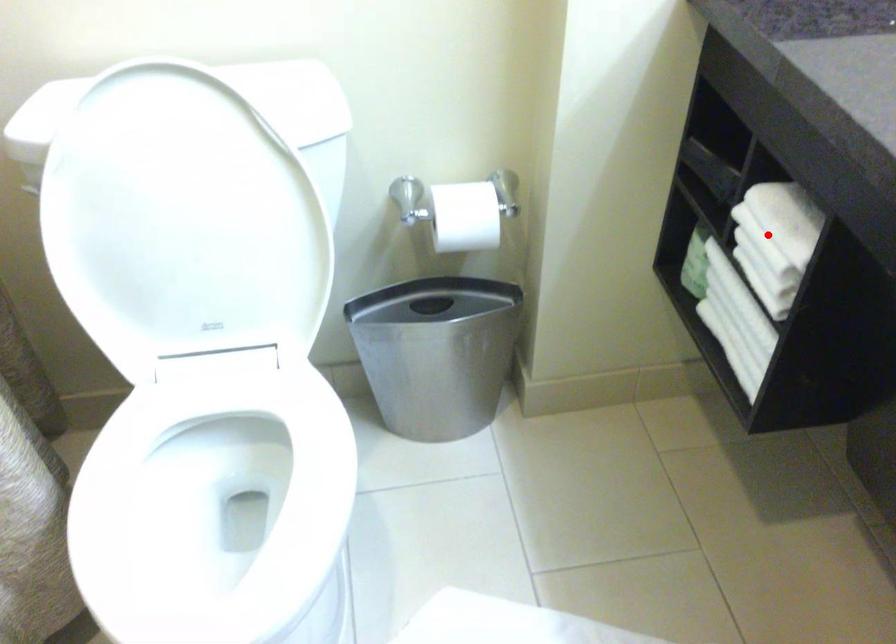
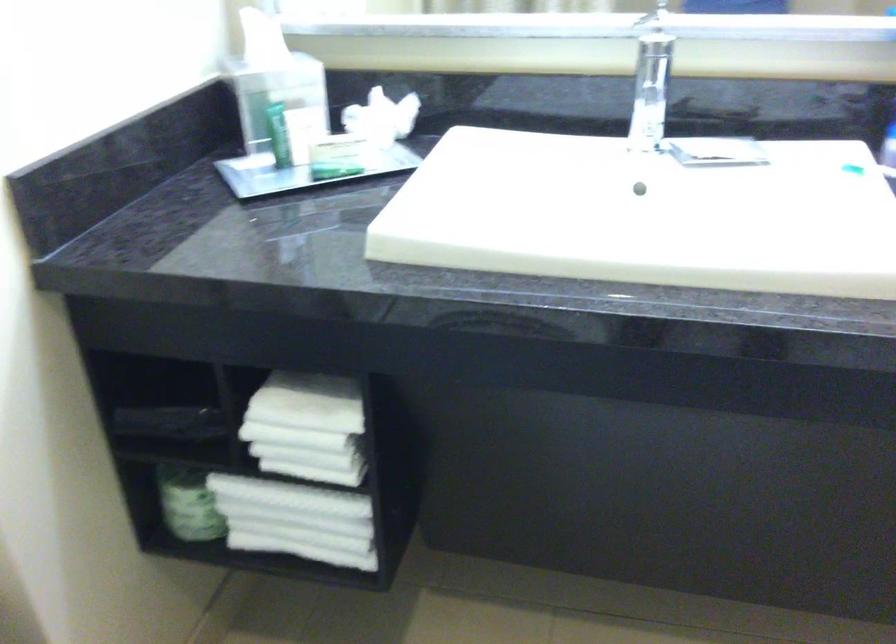
The point at the highlighted location is marked in the first image. Where is the corresponding point in the second image?

(307, 428)